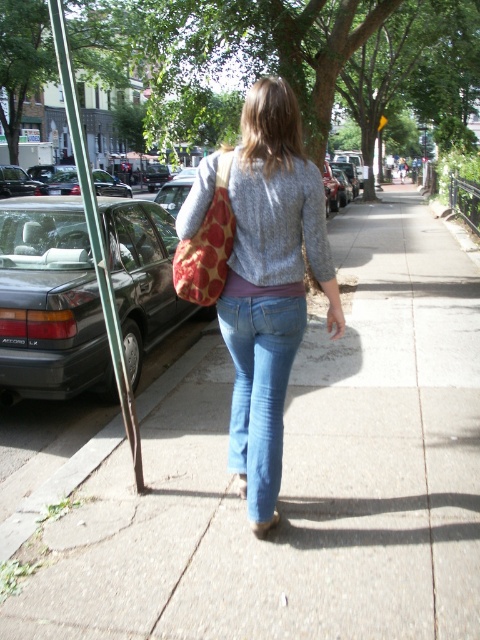
You are a delivery robot that needs to place a package on the sidewalk. The package is 1.5 meters wide. Can you fit the package between the matte concrete sidewalk at center and the denim jeans at center without overlapping either?

The distance between the matte concrete sidewalk at center and the denim jeans at center is 1.66 meters. Since the package is 1.5 meters wide, it can fit as there is enough space between them.

You are standing on the sidewalk and looking down at your feet. Which object is closer to you, the matte concrete sidewalk at center or the denim jeans at center?

The denim jeans at center are closer to you than the matte concrete sidewalk at center.

You are a delivery person standing at the starting point. You need to deliver a package to the person wearing the gray knitted sweater at center. The sidewalk is narrow and has cracks. The dark gray metallic sedan at left is blocking part of the path. Can you reach the person safely without stepping on the cracks?

The dark gray metallic sedan at left is 2.33 meters away from the gray knitted sweater at center. Since the distance is sufficient and the sedan only partially blocks the path, you can navigate around it carefully while avoiding the cracks on the sidewalk to reach the person safely.